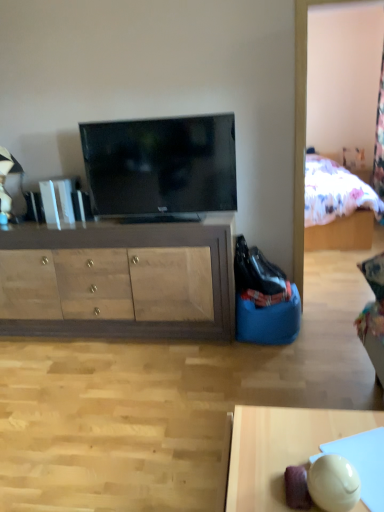
This screenshot has width=384, height=512. What are the coordinates of `vacant space situated above smooth wooden desk at lower right (from a real-world perspective)` in the screenshot? It's located at (308, 447).